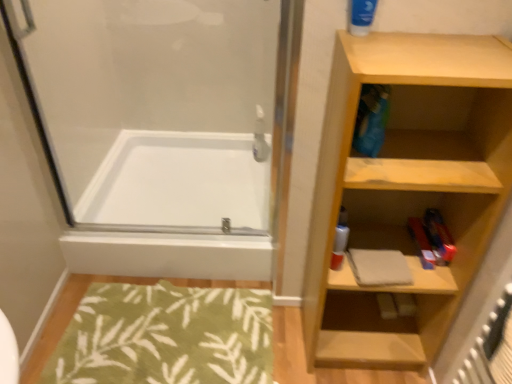
At what (x,y) coordinates should I click in order to perform the action: click on wooden shelf at right. Please return your answer as a coordinate pair (x, y). The image size is (512, 384). Looking at the image, I should click on (407, 189).

Describe the element at coordinates (175, 207) in the screenshot. I see `white glossy bathtub at center` at that location.

What do you see at coordinates (166, 336) in the screenshot?
I see `green leafy rug at lower left` at bounding box center [166, 336].

You are a GUI agent. You are given a task and a screenshot of the screen. Output one action in this format:
    pyautogui.click(x=<x>, y=<y>)
    Task: Click on the wooden shelf at right
    The image size is (512, 384).
    Given the screenshot: What is the action you would take?
    pyautogui.click(x=407, y=189)

Looking at this image, is wooden shelf at right smaller than white glossy bathtub at center?

Indeed, wooden shelf at right has a smaller size compared to white glossy bathtub at center.

Is wooden shelf at right aimed at white glossy bathtub at center?

No, wooden shelf at right is not oriented towards white glossy bathtub at center.

Considering the sizes of objects wooden shelf at right and white glossy bathtub at center in the image provided, who is taller, wooden shelf at right or white glossy bathtub at center?

Standing taller between the two is wooden shelf at right.

Does wooden shelf at right touch white glossy bathtub at center?

No, wooden shelf at right is not making contact with white glossy bathtub at center.

Does green leafy rug at lower left have a greater height compared to blue matte tube at upper right?

No, green leafy rug at lower left is not taller than blue matte tube at upper right.

From the image's perspective, is green leafy rug at lower left positioned above or below blue matte tube at upper right?

From the image's perspective, green leafy rug at lower left appears below blue matte tube at upper right.

Which point is more forward, (183, 344) or (366, 5)?

The point (366, 5) is more forward.

Which of these two, green leafy rug at lower left or blue matte tube at upper right, is wider?

Wider between the two is green leafy rug at lower left.

From a real-world perspective, which is physically below, blue matte tube at upper right or wooden shelf at right?

In real-world perspective, wooden shelf at right is lower.

Looking at this image, is blue matte tube at upper right wider than wooden shelf at right?

In fact, blue matte tube at upper right might be narrower than wooden shelf at right.

How much distance is there between blue matte tube at upper right and wooden shelf at right?

20.00 inches.

Does blue matte tube at upper right lie behind wooden shelf at right?

Yes, blue matte tube at upper right is behind wooden shelf at right.

How different are the orientations of white glossy bathtub at center and wooden shelf at right in degrees?

There is a 0.431-degree angle between the facing directions of white glossy bathtub at center and wooden shelf at right.

Considering the positions of objects white glossy bathtub at center and wooden shelf at right in the image provided, who is in front, white glossy bathtub at center or wooden shelf at right?

wooden shelf at right.

Is white glossy bathtub at center spatially inside wooden shelf at right, or outside of it?

white glossy bathtub at center is located beyond the bounds of wooden shelf at right.

Considering the sizes of green leafy rug at lower left and transparent glass shower door at upper left in the image, is green leafy rug at lower left taller or shorter than transparent glass shower door at upper left?

In the image, green leafy rug at lower left appears to be shorter than transparent glass shower door at upper left.

Is green leafy rug at lower left closer to the viewer compared to transparent glass shower door at upper left?

That is False.

How many degrees apart are the facing directions of green leafy rug at lower left and transparent glass shower door at upper left?

They differ by 1.79 degrees in their facing directions.

Does green leafy rug at lower left turn towards transparent glass shower door at upper left?

No, green leafy rug at lower left is not turned towards transparent glass shower door at upper left.

Is wooden shelf at right smaller than blue matte tube at upper right?

No.

Is blue matte tube at upper right at the back of wooden shelf at right?

wooden shelf at right does not have its back to blue matte tube at upper right.

From a real-world perspective, does wooden shelf at right stand above blue matte tube at upper right?

No, from a real-world perspective, wooden shelf at right is not over blue matte tube at upper right

Between wooden shelf at right and blue matte tube at upper right, which one is positioned behind?

blue matte tube at upper right is behind.

Is blue matte tube at upper right aimed at transparent glass shower door at upper left?

No, blue matte tube at upper right is not oriented towards transparent glass shower door at upper left.

Can you confirm if blue matte tube at upper right is taller than transparent glass shower door at upper left?

No.

Is blue matte tube at upper right positioned far away from transparent glass shower door at upper left?

Yes, blue matte tube at upper right and transparent glass shower door at upper left are quite far apart.

Locate an element on the screen. Image resolution: width=512 pixels, height=384 pixels. screen door that appears behind the blue matte tube at upper right is located at coordinates (162, 128).

Identify the location of bathtub on the left of the wooden shelf at right. The height and width of the screenshot is (384, 512). (175, 207).

Find the location of `bath mat directly beneath the blue matte tube at upper right (from a real-world perspective)`. bath mat directly beneath the blue matte tube at upper right (from a real-world perspective) is located at coordinates (166, 336).

Estimate the real-world distances between objects in this image. Which object is further from blue matte tube at upper right, green leafy rug at lower left or transparent glass shower door at upper left?

green leafy rug at lower left is positioned further to the anchor blue matte tube at upper right.

Considering their positions, is transparent glass shower door at upper left positioned further to wooden shelf at right than blue matte tube at upper right?

Among the two, transparent glass shower door at upper left is located further to wooden shelf at right.

From the image, which object appears to be farther from green leafy rug at lower left, transparent glass shower door at upper left or blue matte tube at upper right?

blue matte tube at upper right is further to green leafy rug at lower left.

Based on their spatial positions, is green leafy rug at lower left or wooden shelf at right closer to white glossy bathtub at center?

The object closer to white glossy bathtub at center is green leafy rug at lower left.

From the image, which object appears to be farther from white glossy bathtub at center, transparent glass shower door at upper left or blue matte tube at upper right?

Among the two, blue matte tube at upper right is located further to white glossy bathtub at center.

When comparing their distances from wooden shelf at right, does green leafy rug at lower left or transparent glass shower door at upper left seem closer?

green leafy rug at lower left.

Which object lies further to the anchor point green leafy rug at lower left, wooden shelf at right or white glossy bathtub at center?

Among the two, wooden shelf at right is located further to green leafy rug at lower left.

Looking at the image, which one is located closer to transparent glass shower door at upper left, blue matte tube at upper right or wooden shelf at right?

wooden shelf at right.

Image resolution: width=512 pixels, height=384 pixels. Identify the location of screen door that lies between blue matte tube at upper right and green leafy rug at lower left from top to bottom. (162, 128).

In order to click on screen door positioned between blue matte tube at upper right and white glossy bathtub at center from near to far in this screenshot , I will do tap(162, 128).

Find the location of `bath mat positioned between wooden shelf at right and white glossy bathtub at center from near to far`. bath mat positioned between wooden shelf at right and white glossy bathtub at center from near to far is located at coordinates (166, 336).

Where is `bathtub between transparent glass shower door at upper left and green leafy rug at lower left from top to bottom`? The height and width of the screenshot is (384, 512). bathtub between transparent glass shower door at upper left and green leafy rug at lower left from top to bottom is located at coordinates (175, 207).